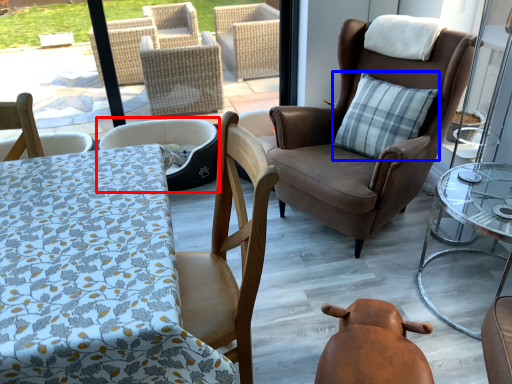
Question: Which object appears closest to the camera in this image, chair (highlighted by a red box) or pillow (highlighted by a blue box)?

Choices:
 (A) chair
 (B) pillow

Answer: (B)